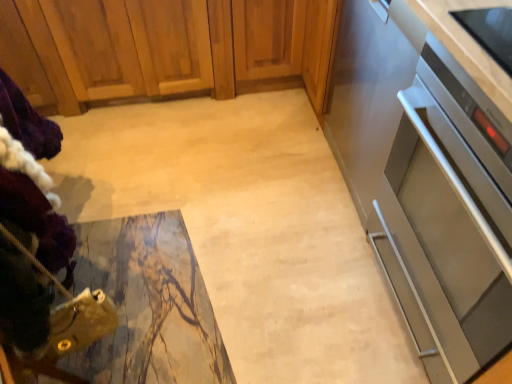
Question: Is stainless steel oven at right bigger or smaller than satin silver oven at right?

Choices:
 (A) big
 (B) small

Answer: (A)

Question: Does point (344, 71) appear closer or farther from the camera than point (503, 205)?

Choices:
 (A) farther
 (B) closer

Answer: (A)

Question: Which object is the closest to the satin silver oven at right?

Choices:
 (A) wooden cabinet at upper left
 (B) stainless steel oven at right

Answer: (B)

Question: Which object is the farthest from the satin silver oven at right?

Choices:
 (A) wooden cabinet at upper left
 (B) stainless steel oven at right

Answer: (A)